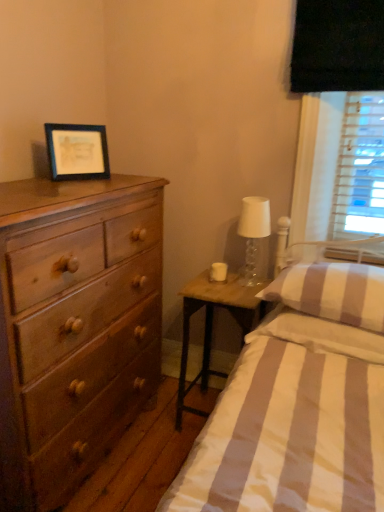
The width and height of the screenshot is (384, 512). In order to click on empty space that is ontop of woodennightstand at right (from a real-world perspective) in this screenshot , I will do `click(236, 284)`.